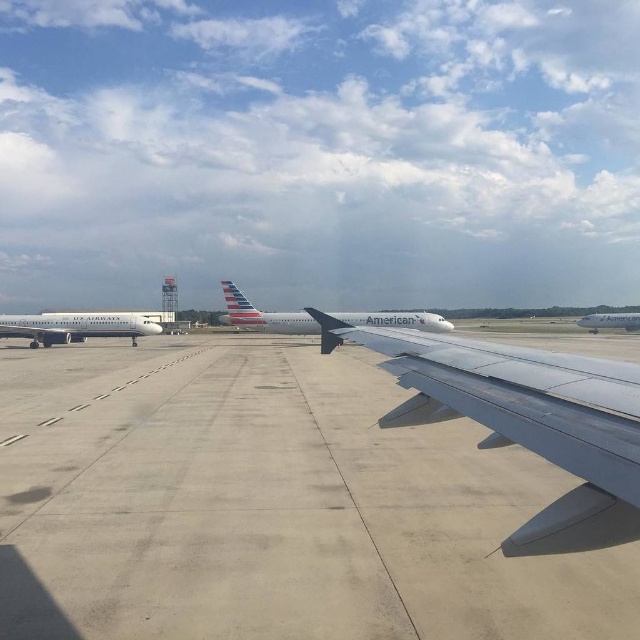
You are a pilot preparing for takeoff and need to check the distance between the gray concrete tarmac at center and the white glossy airplane at center. Is the tarmac above or below the airplane?

The gray concrete tarmac at center is below the white glossy airplane at center.

You are a passenger on the airplane at center. You look out the window and see the gray concrete tarmac at center and the white glossy airplane at center. Which object is closer to the left side of your view?

The gray concrete tarmac at center is to the left of the white glossy airplane at center, so the gray concrete tarmac at center is closer to the left side of your view.